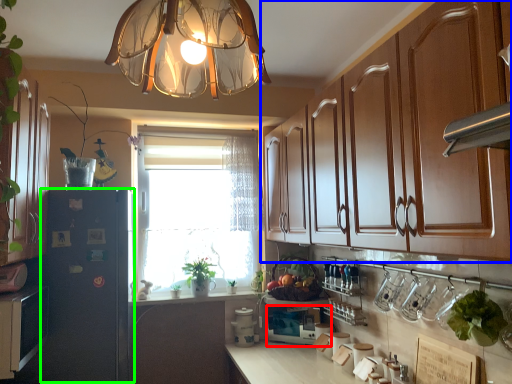
Question: Based on their relative distances, which object is farther from appliance (highlighted by a red box)? Choose from cabinetry (highlighted by a blue box) and fridge (highlighted by a green box).

Choices:
 (A) cabinetry
 (B) fridge

Answer: (B)